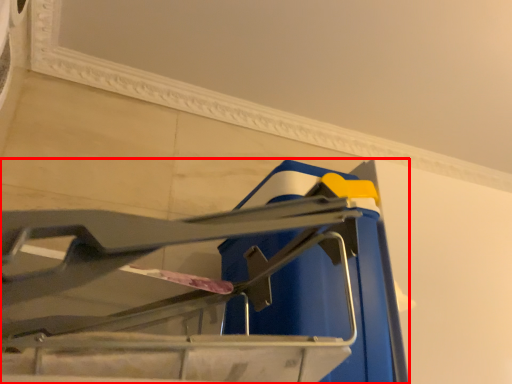
Question: From the image's perspective, where is furniture (annotated by the red box) located relative to window frame?

Choices:
 (A) above
 (B) below

Answer: (B)